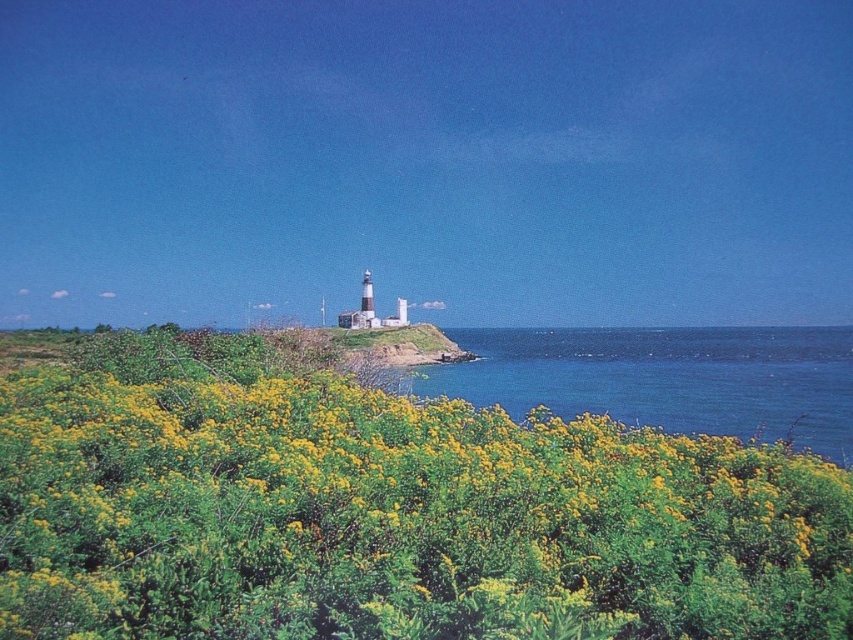
Locate an element on the screen. The width and height of the screenshot is (853, 640). green leafy shrubs at center is located at coordinates (393, 516).

You are a GUI agent. You are given a task and a screenshot of the screen. Output one action in this format:
    pyautogui.click(x=<x>, y=<y>)
    Task: Click on the green leafy shrubs at center
    
    Given the screenshot: What is the action you would take?
    [393, 516]

Where is `green leafy shrubs at center`? green leafy shrubs at center is located at coordinates (393, 516).